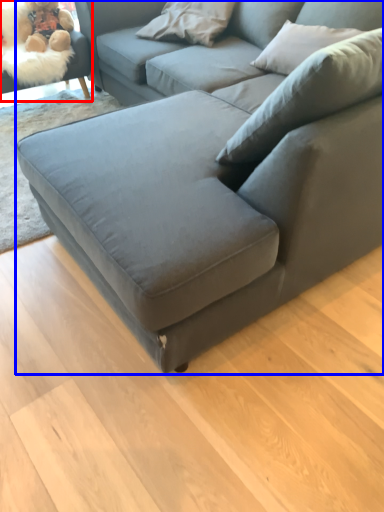
Question: Which object appears farthest to the camera in this image, swivel chair (highlighted by a red box) or studio couch (highlighted by a blue box)?

Choices:
 (A) swivel chair
 (B) studio couch

Answer: (A)